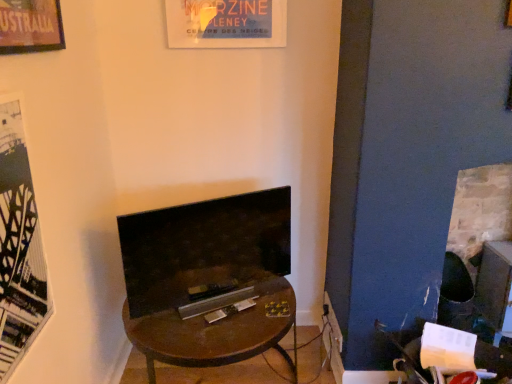
Locate an element on the screen. This screenshot has width=512, height=384. vacant area to the left of metallic silver magazine at center is located at coordinates (198, 302).